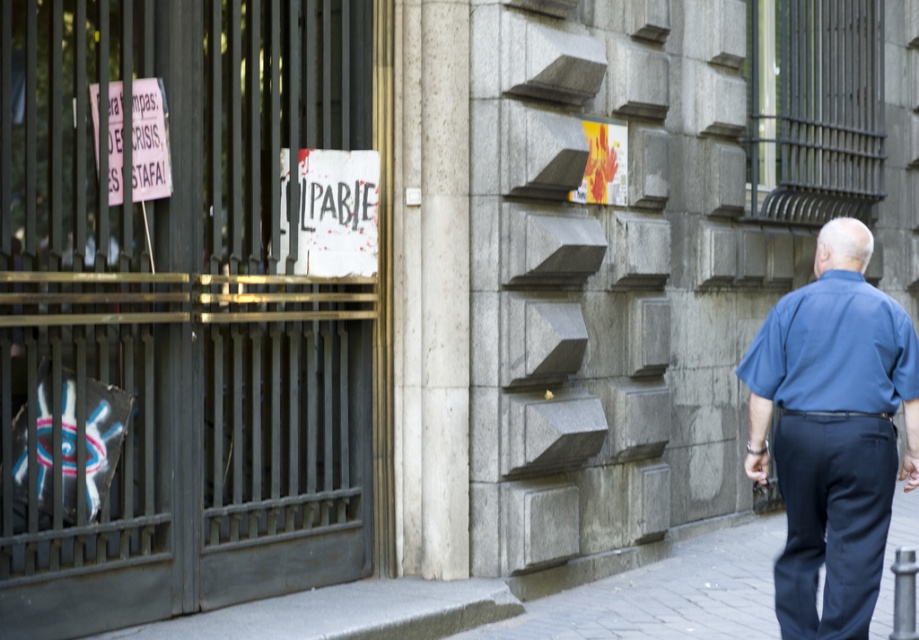
Does point (787, 612) lie behind point (358, 150)?

No, (787, 612) is closer to viewer.

Is blue cotton shirt at right smaller than white paper sign at center?

No, blue cotton shirt at right is not smaller than white paper sign at center.

Does point (834, 330) come farther from viewer compared to point (305, 156)?

No, it is not.

Find the location of a particular element. blue cotton shirt at right is located at coordinates (832, 432).

Which is above, blue short-sleeved shirt at right or white paper sign at center?

white paper sign at center is higher up.

Is blue short-sleeved shirt at right wider than white paper sign at center?

Yes, blue short-sleeved shirt at right is wider than white paper sign at center.

I want to click on blue short-sleeved shirt at right, so click(x=834, y=349).

Is blue cotton shirt at right bigger than gray cobblestone pavement at lower right?

Yes.

Who is positioned more to the left, blue cotton shirt at right or gray cobblestone pavement at lower right?

gray cobblestone pavement at lower right

Where is `blue cotton shirt at right`? The image size is (919, 640). blue cotton shirt at right is located at coordinates (832, 432).

Where is `blue cotton shirt at right`? The image size is (919, 640). blue cotton shirt at right is located at coordinates (832, 432).